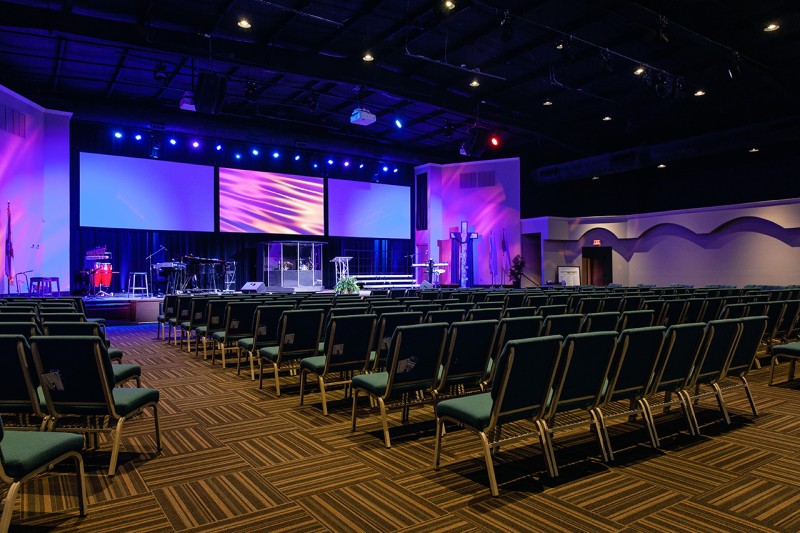
Where is `bulb`? The width and height of the screenshot is (800, 533). bulb is located at coordinates (174, 147).